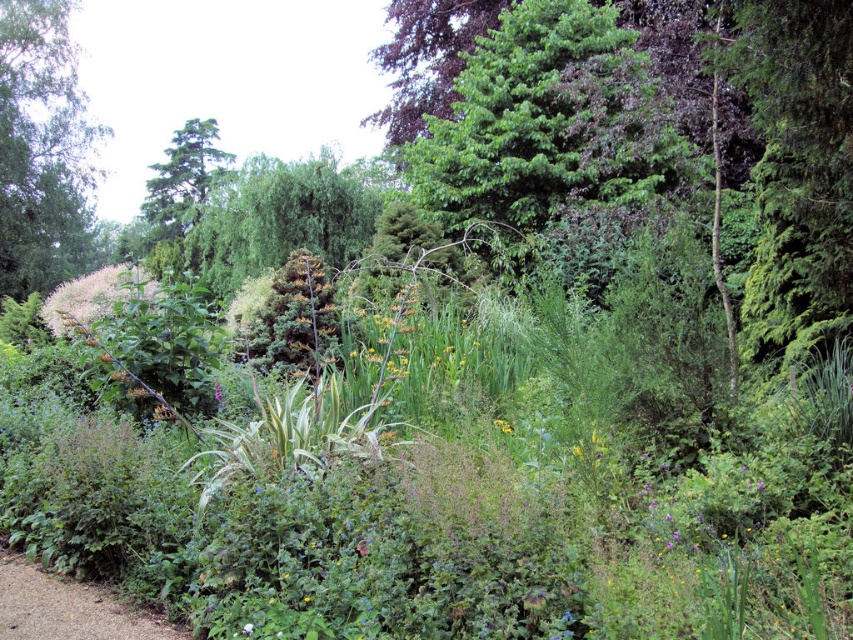
You are a gardener who wants to walk from the gravel path at lower left to the white fluffy flower at center. Which direction should you move?

You should move to the right because the gravel path at lower left is to the left of the white fluffy flower at center, so moving right will take you towards it.

You are standing in the garden and want to reach a point that is exactly 50 meters away from your current position. Is the point at point (78, 250) within that distance?

The point at point (78, 250) is 44.86 meters away from the viewer, which is within the 50 meters distance. Therefore, the point is within the desired range.

You are a gardener planning to plant a new tree that requires 3 meters of vertical space. Based on the garden scene, can the green leafy tree at upper left and the gravel path at lower left accommodate this requirement?

The green leafy tree at upper left is taller than the gravel path at lower left, but the exact height isn not provided. However, since trees typically exceed 3 meters, it might be suitable. The gravel path at lower left is not a tree and cannot accommodate the tree planting requirement.